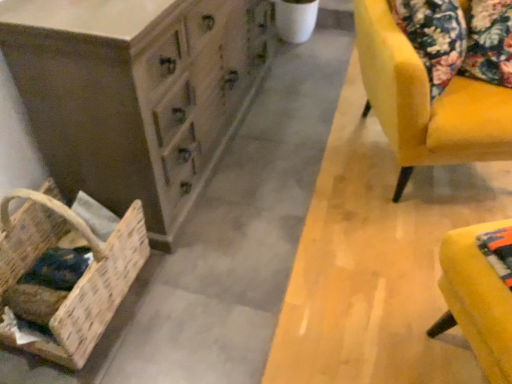
Locate an element on the screen. vacant space that's between yellow fabric ottoman at lower right and woven wood basket at lower left is located at coordinates (261, 317).